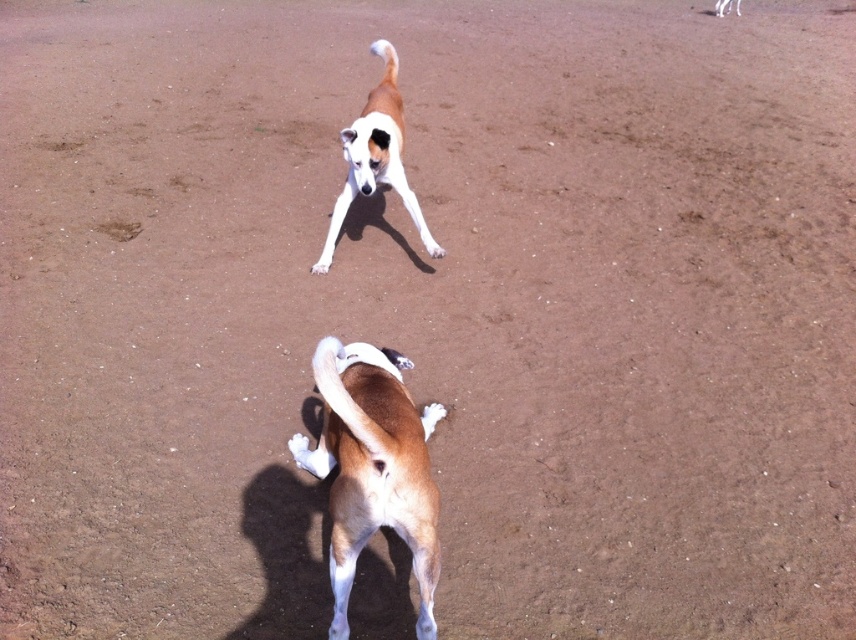
Is brown matte dog at center bigger than brown and white fur dog at center?

Actually, brown matte dog at center might be smaller than brown and white fur dog at center.

In the scene shown: Between brown matte dog at center and brown and white fur dog at center, which one has more height?

brown and white fur dog at center is taller.

What do you see at coordinates (372, 467) in the screenshot? Image resolution: width=856 pixels, height=640 pixels. I see `brown matte dog at center` at bounding box center [372, 467].

Find the location of a particular element. The width and height of the screenshot is (856, 640). brown matte dog at center is located at coordinates (372, 467).